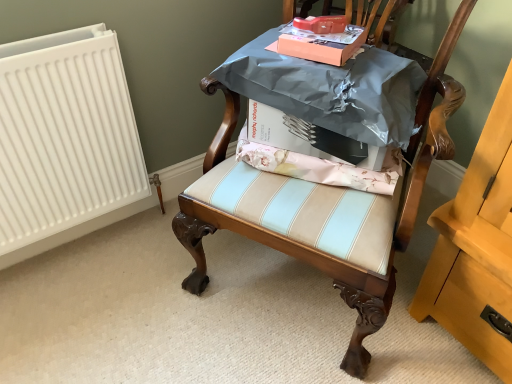
At what (x,y) coordinates should I click in order to perform the action: click on vacant space situated on the left part of wooden chair at center. Please return your answer as a coordinate pair (x, y). Looking at the image, I should click on (130, 296).